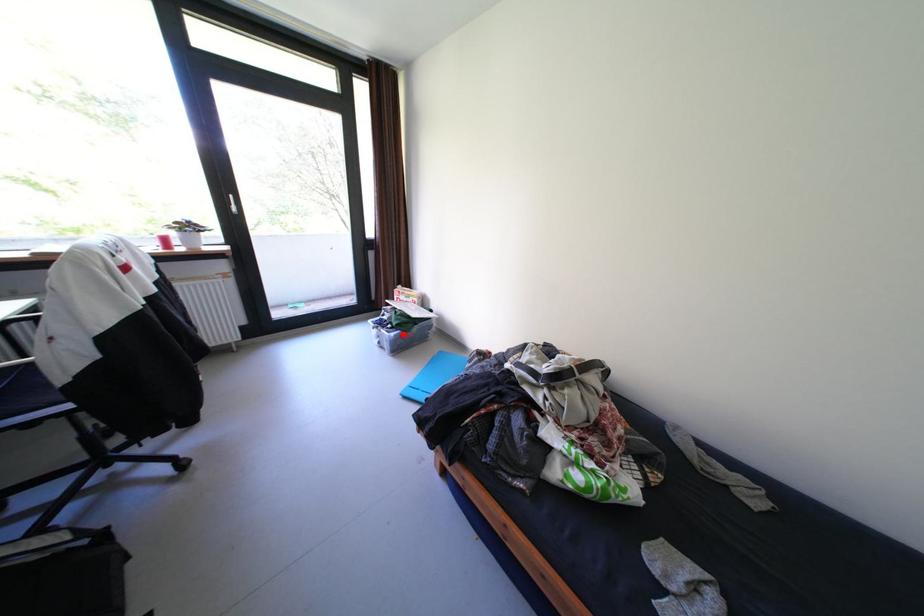
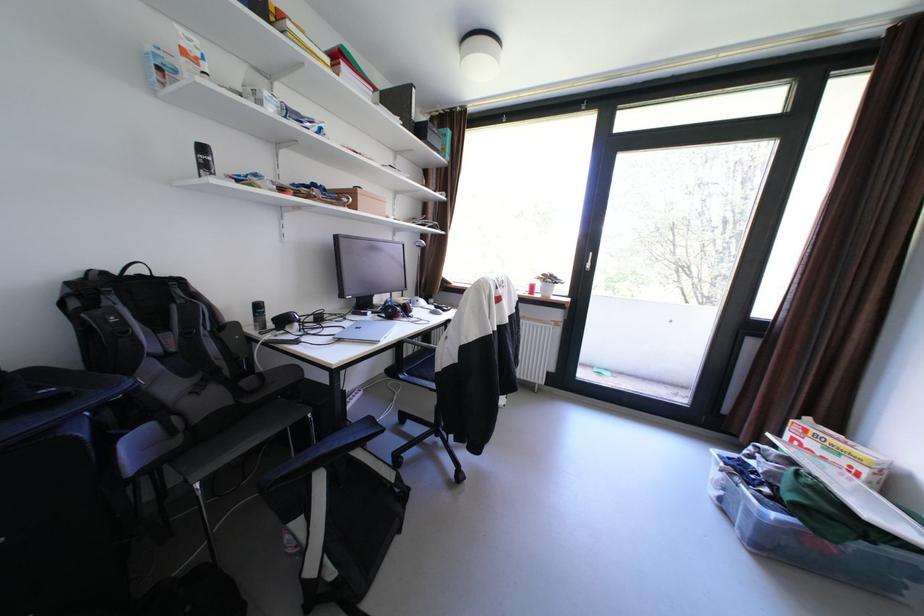
Find the pixel in the second image that matches the highlighted location in the first image.

(784, 516)